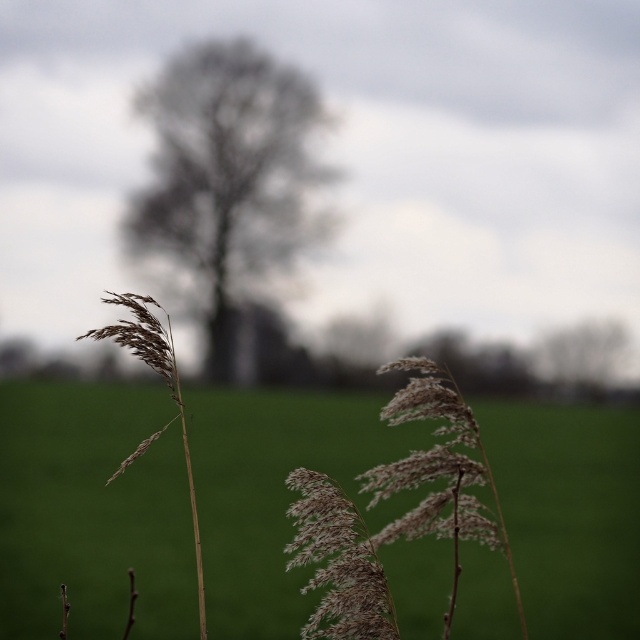
Does white fluffy grass at center come in front of fuzzy beige reed at center?

Yes, it is.

Can you confirm if white fluffy grass at center is wider than fuzzy beige reed at center?

Indeed, white fluffy grass at center has a greater width compared to fuzzy beige reed at center.

Who is more distant from viewer, [256,588] or [157,364]?

The point [256,588] is more distant.

You are a GUI agent. You are given a task and a screenshot of the screen. Output one action in this format:
    pyautogui.click(x=<x>, y=<y>)
    Task: Click on the white fluffy grass at center
    
    Given the screenshot: What is the action you would take?
    [92, 513]

Does white fluffy grass at center have a lesser width compared to dark brown textured tree at center?

In fact, white fluffy grass at center might be wider than dark brown textured tree at center.

Between point (0, 636) and point (244, 128), which one is positioned behind?

Positioned behind is point (244, 128).

This screenshot has height=640, width=640. Identify the location of white fluffy grass at center. click(x=92, y=513).

Can you confirm if dark brown textured tree at center is shorter than fuzzy beige reed at center?

No, dark brown textured tree at center is not shorter than fuzzy beige reed at center.

Which is more to the left, dark brown textured tree at center or fuzzy beige reed at center?

Positioned to the left is dark brown textured tree at center.

Locate an element on the screen. This screenshot has width=640, height=640. dark brown textured tree at center is located at coordinates (227, 173).